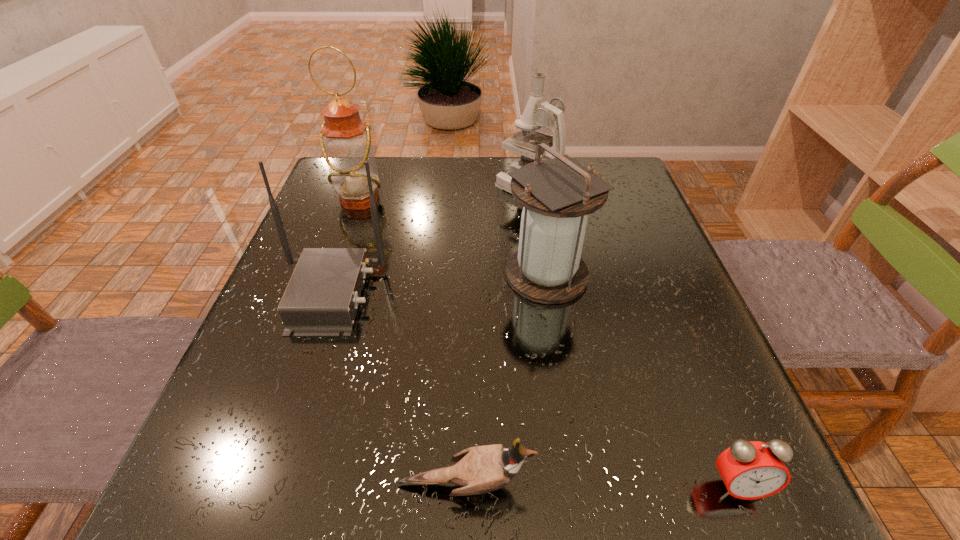
The image size is (960, 540). In order to click on vacant area located 0.190m on the back of the router to connect cables in this screenshot , I will do click(473, 294).

The image size is (960, 540). I want to click on free space located at the face of the fifth tallest object, so click(x=719, y=484).

Identify the location of oil lamp that is at the far edge. (345, 139).

Locate an element on the screen. microscope that is positioned at the far edge is located at coordinates (537, 113).

Locate an element on the screen. The image size is (960, 540). bird located at the near edge is located at coordinates (482, 469).

Find the location of a particular element. alarm clock located in the near edge section of the desktop is located at coordinates (750, 470).

Where is `oil lamp present at the left edge`? The height and width of the screenshot is (540, 960). oil lamp present at the left edge is located at coordinates (345, 139).

This screenshot has height=540, width=960. In order to click on router that is at the left edge in this screenshot , I will do `click(322, 297)`.

Where is `object at the right edge`? This screenshot has height=540, width=960. object at the right edge is located at coordinates (750, 470).

Find the location of a particular element. object located at the far left corner is located at coordinates (345, 139).